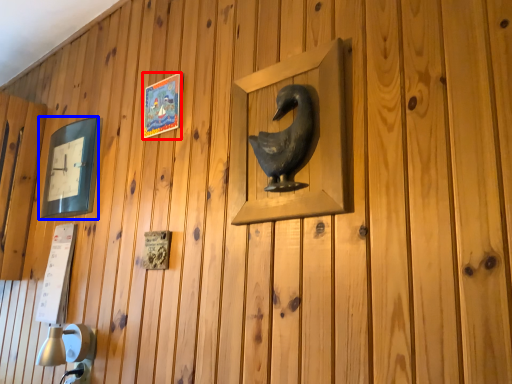
Question: Among these objects, which one is nearest to the camera, picture frame (highlighted by a red box) or picture frame (highlighted by a blue box)?

Choices:
 (A) picture frame
 (B) picture frame

Answer: (A)